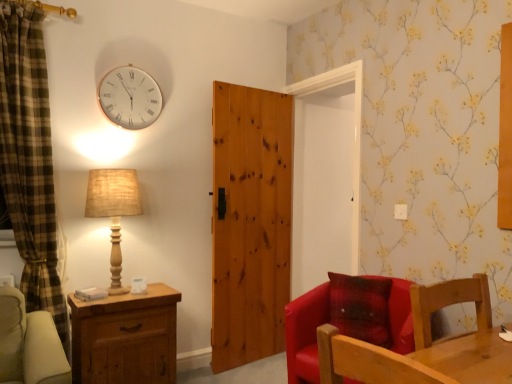
The height and width of the screenshot is (384, 512). What do you see at coordinates (250, 223) in the screenshot?
I see `natural wood door at center` at bounding box center [250, 223].

What do you see at coordinates (125, 338) in the screenshot? The width and height of the screenshot is (512, 384). I see `brown wooden chest of drawers at lower left` at bounding box center [125, 338].

Where is `white glass clock at upper left`? The width and height of the screenshot is (512, 384). white glass clock at upper left is located at coordinates (129, 97).

Measure the distance between wooden chair at lower right, arranged as the first chair when viewed from the front, and camera.

4.23 feet.

Locate an element on the screen. This screenshot has height=384, width=512. natural wood door at center is located at coordinates (250, 223).

I want to click on door above the matte red leather chair at center, the second chair positioned from the front (from a real-world perspective), so click(250, 223).

Relative to matte red leather chair at center, arranged as the 1th chair when viewed from the back, is natural wood door at center in front or behind?

natural wood door at center is positioned farther from the viewer than matte red leather chair at center, arranged as the 1th chair when viewed from the back.

Can you confirm if natural wood door at center is thinner than matte red leather chair at center, the second chair positioned from the front?

Indeed, natural wood door at center has a lesser width compared to matte red leather chair at center, the second chair positioned from the front.

Are natural wood door at center and matte red leather chair at center, the second chair positioned from the front, beside each other?

No, natural wood door at center is not in contact with matte red leather chair at center, the second chair positioned from the front.

Identify the location of table lamp located behind the matte red leather chair at center, the second chair positioned from the front. (113, 210).

Looking at this image, who is taller, burlap lampshade at left or matte red leather chair at center, arranged as the 1th chair when viewed from the back?

burlap lampshade at left is taller.

Can you tell me how much burlap lampshade at left and matte red leather chair at center, the second chair positioned from the front, differ in facing direction?

burlap lampshade at left and matte red leather chair at center, the second chair positioned from the front, are facing 69.5 degrees away from each other.

Is point (99, 204) more distant than point (401, 295)?

Yes.

Is burlap lampshade at left behind white glass clock at upper left?

No, burlap lampshade at left is closer to the viewer.

Is burlap lampshade at left to the right of white glass clock at upper left from the viewer's perspective?

In fact, burlap lampshade at left is to the left of white glass clock at upper left.

The image size is (512, 384). I want to click on wall clock on the right of burlap lampshade at left, so (x=129, y=97).

Between burlap lampshade at left and white glass clock at upper left, which one has more height?

With more height is burlap lampshade at left.

Which object is closer to the camera taking this photo, wooden chair at lower right, arranged as the first chair when viewed from the front, or brown wooden chest of drawers at lower left?

wooden chair at lower right, arranged as the first chair when viewed from the front, is more forward.

Are wooden chair at lower right, arranged as the first chair when viewed from the front, and brown wooden chest of drawers at lower left far apart?

wooden chair at lower right, arranged as the first chair when viewed from the front, is far away from brown wooden chest of drawers at lower left.

Considering the sizes of wooden chair at lower right, arranged as the first chair when viewed from the front, and brown wooden chest of drawers at lower left in the image, is wooden chair at lower right, arranged as the first chair when viewed from the front, taller or shorter than brown wooden chest of drawers at lower left?

Considering their sizes, wooden chair at lower right, arranged as the first chair when viewed from the front, has less height than brown wooden chest of drawers at lower left.

Is wooden chair at lower right, which is counted as the second chair, starting from the back, aimed at brown wooden chest of drawers at lower left?

No, wooden chair at lower right, which is counted as the second chair, starting from the back, is not turned towards brown wooden chest of drawers at lower left.

Considering the relative sizes of burlap lampshade at left and natural wood door at center in the image provided, is burlap lampshade at left taller than natural wood door at center?

No, burlap lampshade at left is not taller than natural wood door at center.

Which is nearer, (106, 199) or (261, 224)?

Point (106, 199) appears to be closer to the viewer than point (261, 224).

Between burlap lampshade at left and natural wood door at center, which one appears on the right side from the viewer's perspective?

Positioned to the right is natural wood door at center.

In terms of size, does burlap lampshade at left appear bigger or smaller than natural wood door at center?

Clearly, burlap lampshade at left is smaller in size than natural wood door at center.

Is white glass clock at upper left at the back of wooden chair at lower right, which is counted as the second chair, starting from the back?

That's not correct — wooden chair at lower right, which is counted as the second chair, starting from the back, is not looking away from white glass clock at upper left.

How many degrees apart are the facing directions of wooden chair at lower right, arranged as the first chair when viewed from the front, and white glass clock at upper left?

There is a 0.768-degree angle between the facing directions of wooden chair at lower right, arranged as the first chair when viewed from the front, and white glass clock at upper left.

From the image's perspective, count 1st chairs downward from the white glass clock at upper left and point to it. Please provide its 2D coordinates.

[(448, 304)]

Which object is positioned more to the right, wooden chair at lower right, arranged as the first chair when viewed from the front, or white glass clock at upper left?

From the viewer's perspective, wooden chair at lower right, arranged as the first chair when viewed from the front, appears more on the right side.

From a real-world perspective, is wooden chair at lower right, arranged as the first chair when viewed from the front, physically above burlap lampshade at left?

Incorrect, from a real-world perspective, wooden chair at lower right, arranged as the first chair when viewed from the front, is lower than burlap lampshade at left.

The image size is (512, 384). I want to click on table lamp above the wooden chair at lower right, which is counted as the second chair, starting from the back (from a real-world perspective), so click(113, 210).

From the image's perspective, who appears lower, wooden chair at lower right, which is counted as the second chair, starting from the back, or burlap lampshade at left?

wooden chair at lower right, which is counted as the second chair, starting from the back, from the image's perspective.

At what (x,y) coordinates should I click in order to perform the action: click on door behind the matte red leather chair at center, the second chair positioned from the front. Please return your answer as a coordinate pair (x, y). Looking at the image, I should click on (250, 223).

Where is `table lamp above the matte red leather chair at center, arranged as the 1th chair when viewed from the back (from a real-world perspective)`? The width and height of the screenshot is (512, 384). table lamp above the matte red leather chair at center, arranged as the 1th chair when viewed from the back (from a real-world perspective) is located at coordinates (113, 210).

In the scene shown: Estimate the real-world distances between objects in this image. Which object is further from brown wooden chest of drawers at lower left, burlap lampshade at left or matte red leather chair at center, the second chair positioned from the front?

Among the two, matte red leather chair at center, the second chair positioned from the front, is located further to brown wooden chest of drawers at lower left.

Estimate the real-world distances between objects in this image. Which object is closer to matte red leather chair at center, the second chair positioned from the front, wooden chair at lower right, arranged as the first chair when viewed from the front, or natural wood door at center?

The object closer to matte red leather chair at center, the second chair positioned from the front, is wooden chair at lower right, arranged as the first chair when viewed from the front.

Considering their positions, is burlap lampshade at left positioned further to matte red leather chair at center, the second chair positioned from the front, than white glass clock at upper left?

white glass clock at upper left is positioned further to the anchor matte red leather chair at center, the second chair positioned from the front.

Considering their positions, is white glass clock at upper left positioned closer to matte red leather chair at center, the second chair positioned from the front, than wooden chair at lower right, arranged as the first chair when viewed from the front?

Among the two, wooden chair at lower right, arranged as the first chair when viewed from the front, is located nearer to matte red leather chair at center, the second chair positioned from the front.

When comparing their distances from white glass clock at upper left, does burlap lampshade at left or brown wooden chest of drawers at lower left seem closer?

burlap lampshade at left is positioned closer to the anchor white glass clock at upper left.

Looking at the image, which one is located further to wooden chair at lower right, arranged as the first chair when viewed from the front, white glass clock at upper left or brown wooden chest of drawers at lower left?

white glass clock at upper left is further to wooden chair at lower right, arranged as the first chair when viewed from the front.

From the image, which object appears to be farther from white glass clock at upper left, natural wood door at center or brown wooden chest of drawers at lower left?

brown wooden chest of drawers at lower left.

Which object lies nearer to the anchor point matte red leather chair at center, the second chair positioned from the front, white glass clock at upper left or brown wooden chest of drawers at lower left?

brown wooden chest of drawers at lower left is positioned closer to the anchor matte red leather chair at center, the second chair positioned from the front.

Find the location of a particular element. This screenshot has width=512, height=384. door located between burlap lampshade at left and matte red leather chair at center, the second chair positioned from the front, in the left-right direction is located at coordinates (250, 223).

Where is `door between white glass clock at upper left and matte red leather chair at center, arranged as the 1th chair when viewed from the back, in the up-down direction`? Image resolution: width=512 pixels, height=384 pixels. door between white glass clock at upper left and matte red leather chair at center, arranged as the 1th chair when viewed from the back, in the up-down direction is located at coordinates (250, 223).

Identify the location of chair situated between brown wooden chest of drawers at lower left and wooden chair at lower right, which is counted as the second chair, starting from the back, from left to right. Image resolution: width=512 pixels, height=384 pixels. (347, 319).

The height and width of the screenshot is (384, 512). Identify the location of table lamp between wooden chair at lower right, which is counted as the second chair, starting from the back, and natural wood door at center, along the z-axis. (113, 210).